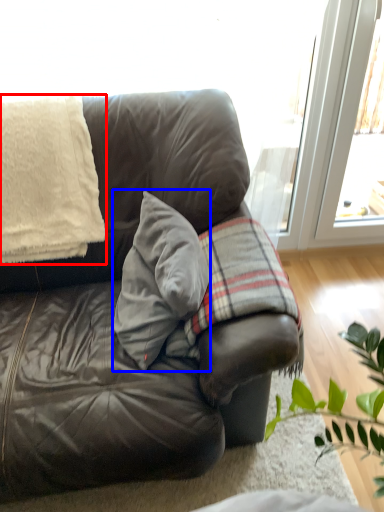
Question: Among these objects, which one is nearest to the camera, blanket (highlighted by a red box) or throw pillow (highlighted by a blue box)?

Choices:
 (A) blanket
 (B) throw pillow

Answer: (B)